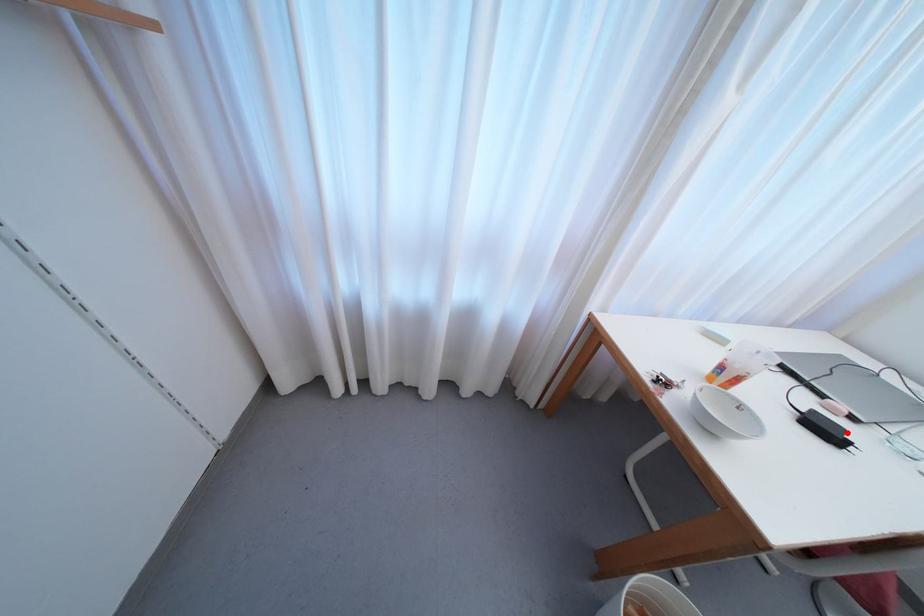
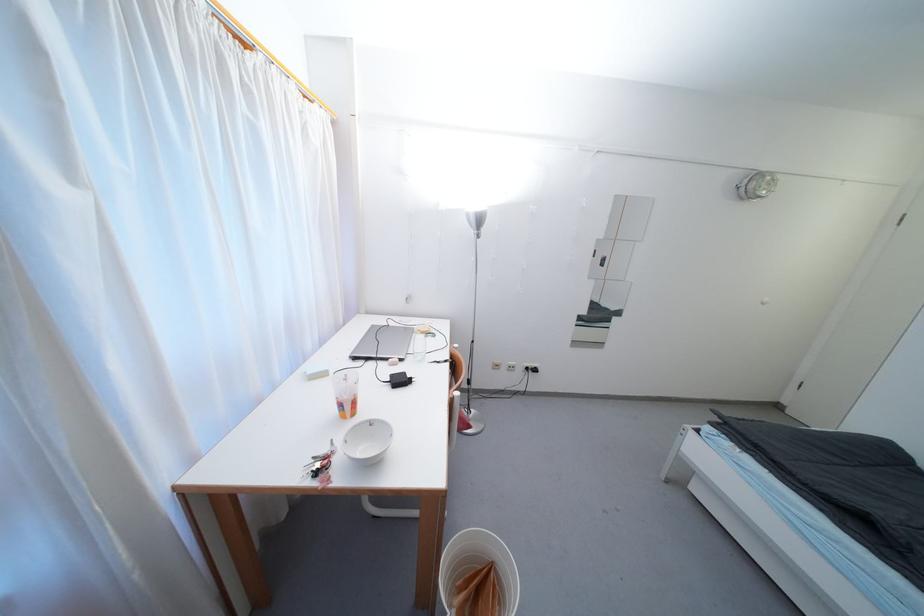
The point at the highlighted location is marked in the first image. Where is the corresponding point in the second image?

(408, 376)